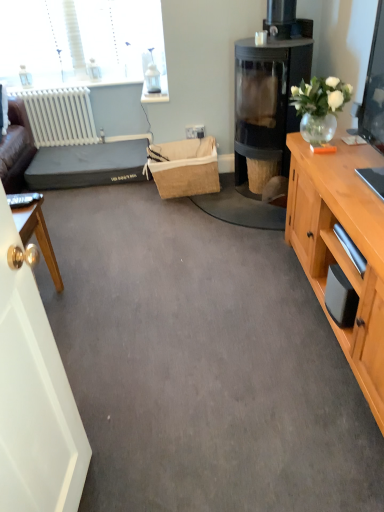
Where is `free area behind polished wood desk at left`? free area behind polished wood desk at left is located at coordinates (81, 268).